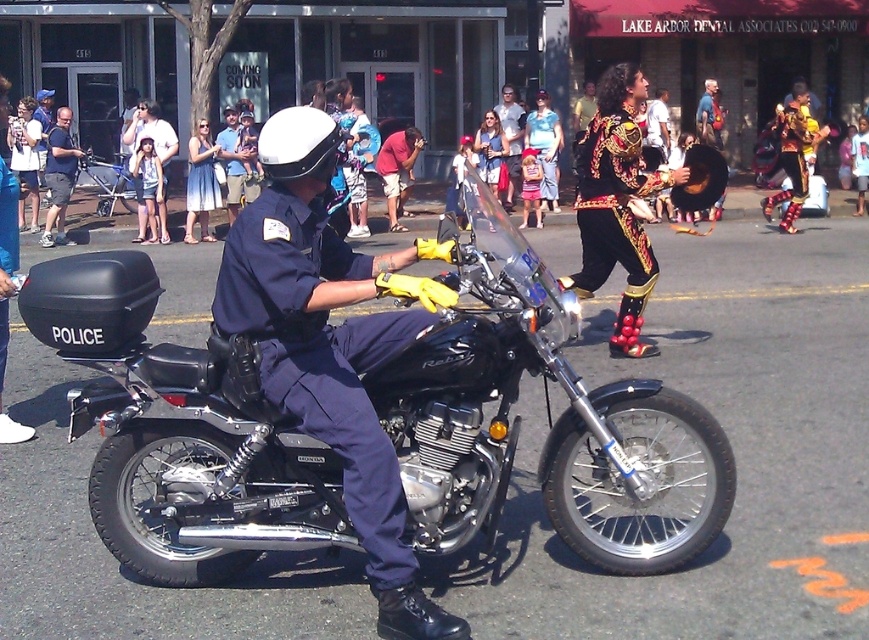
You are a photographer at the parade. You want to capture both the navy blue uniform at center and the shiny gold costume at center in a single photo. Which subject should you focus on to ensure both are in frame?

The navy blue uniform at center is smaller than the shiny gold costume at center, so focusing on the shiny gold costume at center will allow both subjects to fit within the frame.

You are a drone operator assigned to capture aerial footage of the parade. The drone has a GPS system that allows you to input coordinates to position it above specific objects. You need to hover the drone directly above the black matte police motorcycle at center. What coordinates should you input into the drone?

You should input the coordinates point (549, 422) into the drone to hover directly above the black matte police motorcycle at center.

You are a photographer standing at the back of the crowd. You want to take a photo of both the navy blue uniform at center and the shiny gold costume at center. Which one will appear larger in your photo?

The navy blue uniform at center will appear larger in your photo because it is closer to the viewer than the shiny gold costume at center.